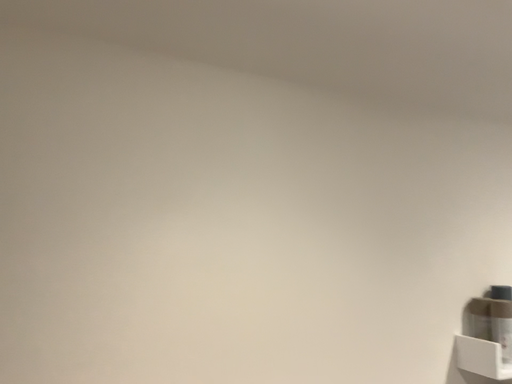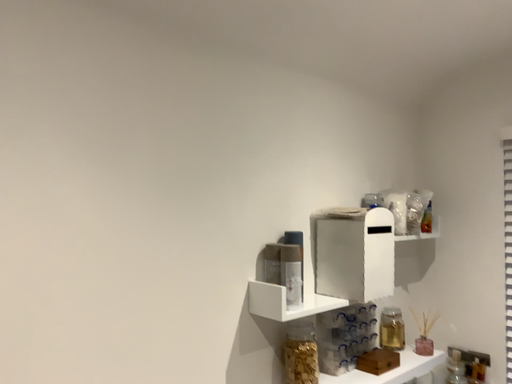
Question: How did the camera likely rotate when shooting the video?

Choices:
 (A) rotated left
 (B) rotated right

Answer: (B)